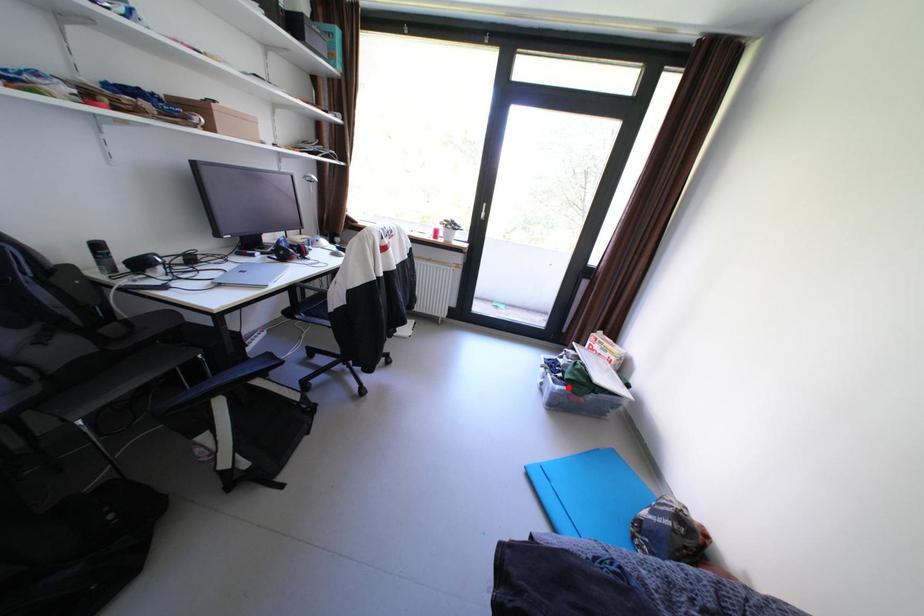
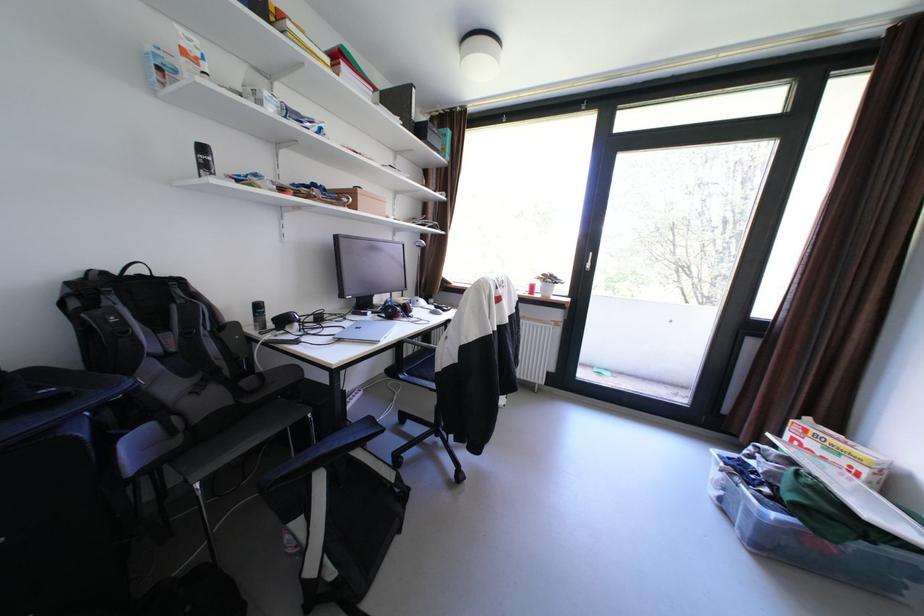
Question: I am providing you with two images of the same scene from different viewpoints. In image1, a red point is highlighted. Considering the same 3D point in image2, which of the following is correct?

Choices:
 (A) It is closer
 (B) It is farther

Answer: (A)